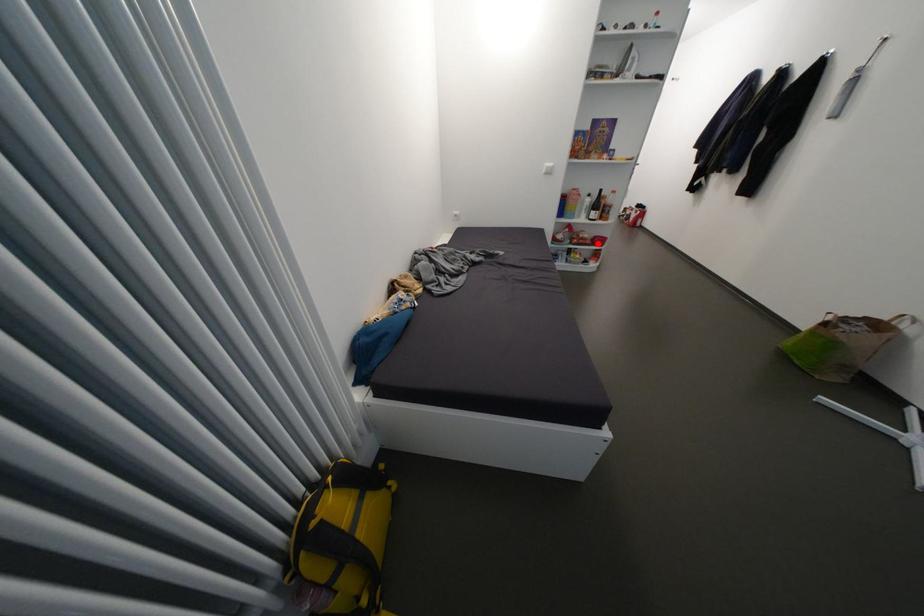
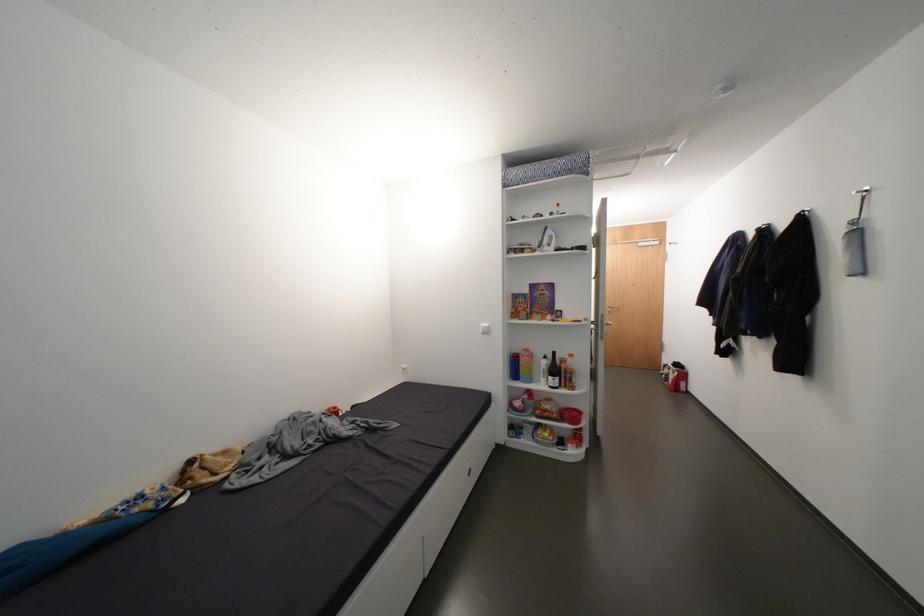
Question: I am providing you with two images of the same scene from different viewpoints. In image1, a red point is highlighted. Considering the same 3D point in image2, which of the following is correct?

Choices:
 (A) It is closer
 (B) It is farther

Answer: (B)